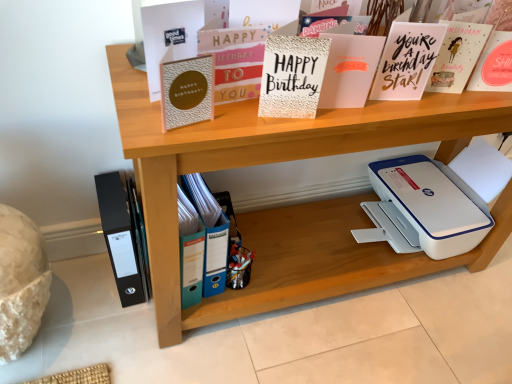
Identify the location of vacant region to the right of matte gold card at upper center, which appears as the 6th paperback book when viewed from the left. (450, 105).